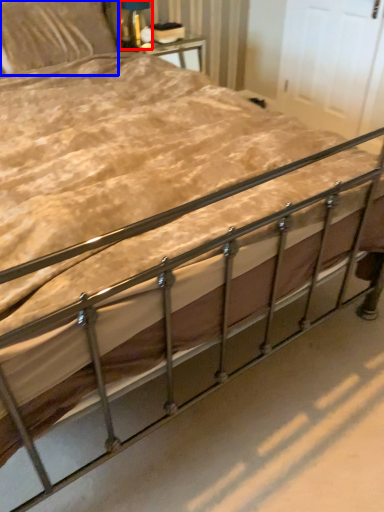
Question: Which point is closer to the camera, table lamp (highlighted by a red box) or pillow (highlighted by a blue box)?

Choices:
 (A) table lamp
 (B) pillow

Answer: (B)